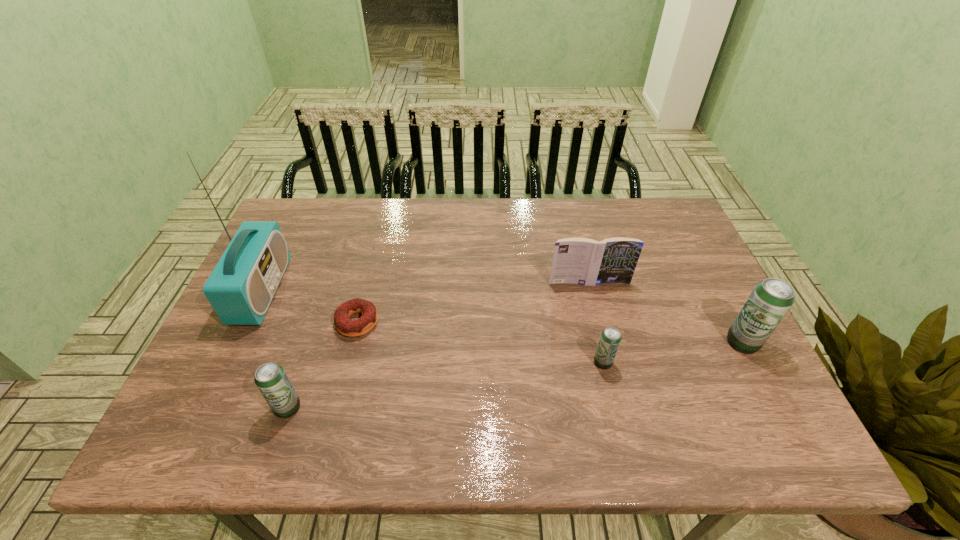
At what (x,y) coordinates should I click in order to perform the action: click on free spot between the nearest object and the radio receiver. Please return your answer as a coordinate pair (x, y). This screenshot has height=540, width=960. Looking at the image, I should click on (275, 349).

Find the location of a particular element. free space that is in between the shortest object and the tallest object is located at coordinates (309, 306).

At what (x,y) coordinates should I click in order to perform the action: click on vacant area that lies between the leftmost object and the nearest beer can. Please return your answer as a coordinate pair (x, y). The image size is (960, 540). Looking at the image, I should click on (275, 349).

Identify the location of free spot between the second object from left to right and the rightmost object. The image size is (960, 540). (516, 375).

I want to click on empty location between the fifth tallest object and the leftmost object, so click(432, 327).

Find the location of a particular element. free space between the second tallest object and the leftmost object is located at coordinates (502, 316).

Locate which object ranks third in proximity to the tallest object. Please provide its 2D coordinates. Your answer should be formatted as a tuple, i.e. [(x, y)], where the tuple contains the x and y coordinates of a point satisfying the conditions above.

[(583, 261)]

Point out which object is positioned as the nearest to the second tallest beer can. Please provide its 2D coordinates. Your answer should be formatted as a tuple, i.e. [(x, y)], where the tuple contains the x and y coordinates of a point satisfying the conditions above.

[(352, 328)]

Choose which beer can is the second nearest neighbor to the tallest beer can. Please provide its 2D coordinates. Your answer should be formatted as a tuple, i.e. [(x, y)], where the tuple contains the x and y coordinates of a point satisfying the conditions above.

[(270, 378)]

Where is `the closest beer can to the fourth object from right to left`? the closest beer can to the fourth object from right to left is located at coordinates (270, 378).